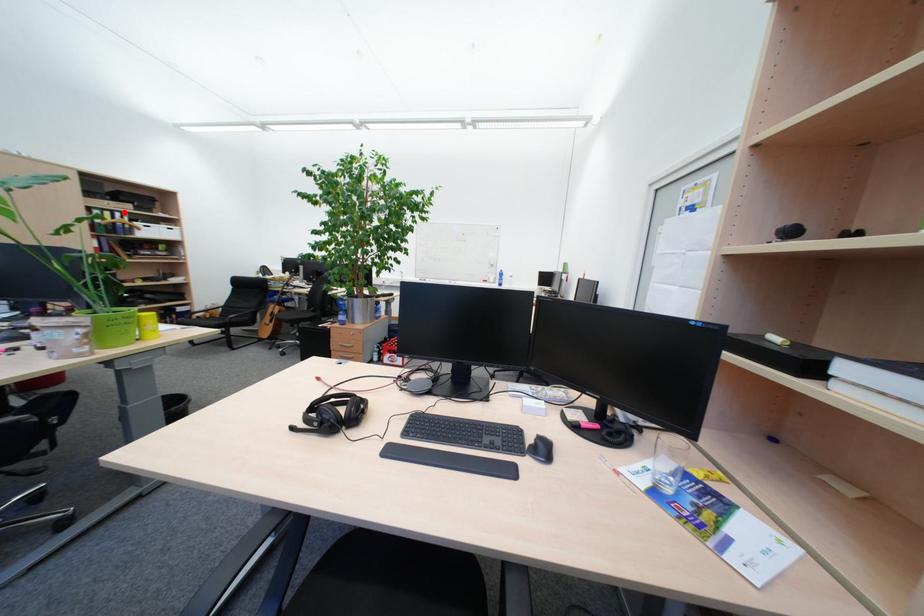
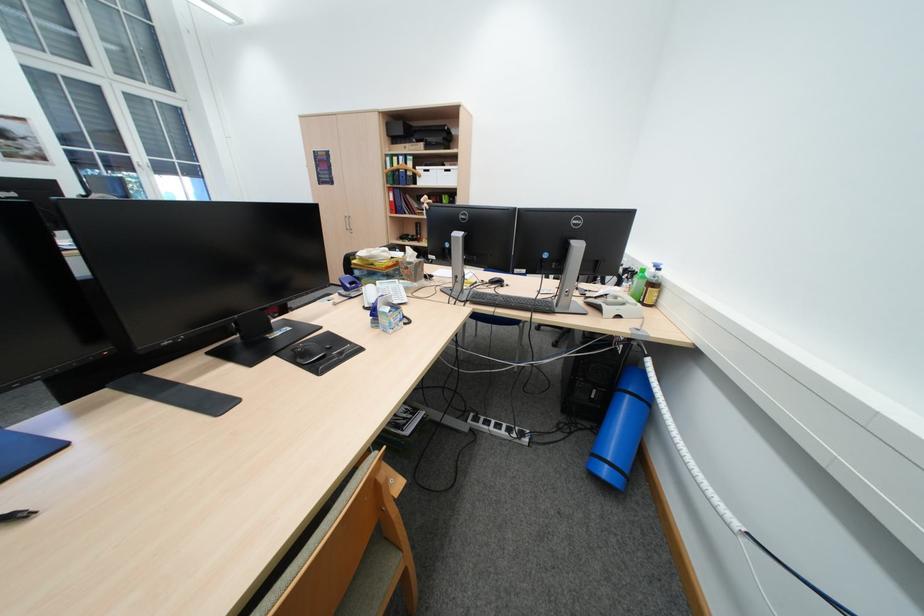
Locate, in the second image, the point that corresponds to the highlighted location in the first image.

(409, 156)